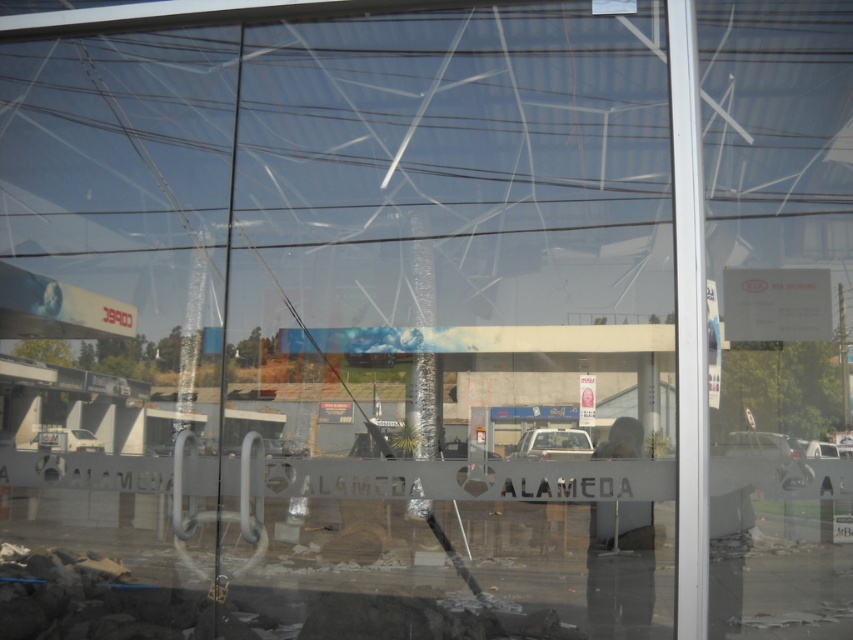
You are standing inside the commercial building looking through the cracked glass window. You notice two points on the glass at coordinates point (558, 429) and point (820, 456). Which point is closer to your eyes?

Point (820, 456) is closer to your eyes because it is less further to the camera than point (558, 429).

You are a delivery driver who needs to park your 6.5 feet tall truck between the metallic silver car at lower right and the white glossy car at lower left. Can you fit your truck between them based on their heights?

The metallic silver car at lower right is not as tall as white glossy car at lower left, so the tallest vehicle between them is the white glossy car at lower left. Since your truck is 6.5 feet tall and the white glossy car at lower left is taller than the metallic silver car at lower right, you need to compare the truck height with the tallest vehicle. If the white glossy car at lower left is taller than 6.5 feet, then your truck can fit between them. However, if the white glossy car at lower left is not as

You are a delivery driver who needs to park your car in the parking lot outside the building. You see the metallic silver car at lower right and the white glossy car at center through the window. Which car is parked closer to the entrance of the building?

The metallic silver car at lower right is located above the white glossy car at center in the image, which means it is actually closer to the entrance of the building since objects higher in the reflection are nearer to the viewer.